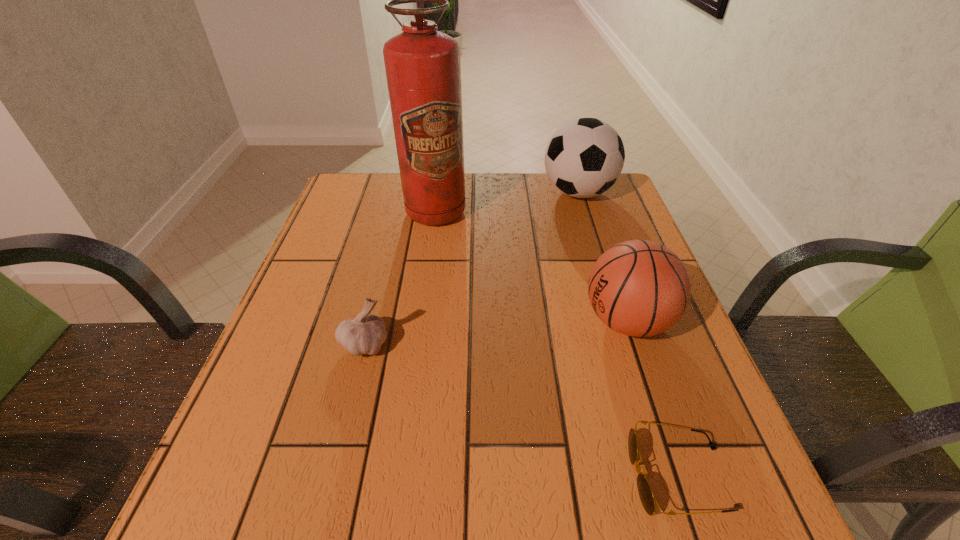
You are a GUI agent. You are given a task and a screenshot of the screen. Output one action in this format:
    pyautogui.click(x=<x>, y=<y>)
    Task: Click on the basketball located in the right edge section of the desktop
    Image resolution: width=960 pixels, height=540 pixels.
    Given the screenshot: What is the action you would take?
    pyautogui.click(x=640, y=288)

Locate an element on the screen. sunglasses at the right edge is located at coordinates (647, 498).

This screenshot has width=960, height=540. I want to click on object that is positioned at the far right corner, so click(584, 158).

Identify the location of object located in the near right corner section of the desktop. Image resolution: width=960 pixels, height=540 pixels. (647, 498).

Image resolution: width=960 pixels, height=540 pixels. In the image, there is a desktop. Identify the location of vacant space at the far edge. (475, 211).

The image size is (960, 540). I want to click on free space at the near edge of the desktop, so click(x=496, y=482).

Locate an element on the screen. This screenshot has width=960, height=540. vacant region at the left edge is located at coordinates (322, 421).

Locate an element on the screen. free space at the right edge of the desktop is located at coordinates (718, 448).

Where is `vacant space at the near left corner`? This screenshot has height=540, width=960. vacant space at the near left corner is located at coordinates (226, 512).

Find the location of a particular element. This screenshot has width=960, height=540. vacant space that's between the fire extinguisher and the soccer ball is located at coordinates point(507,202).